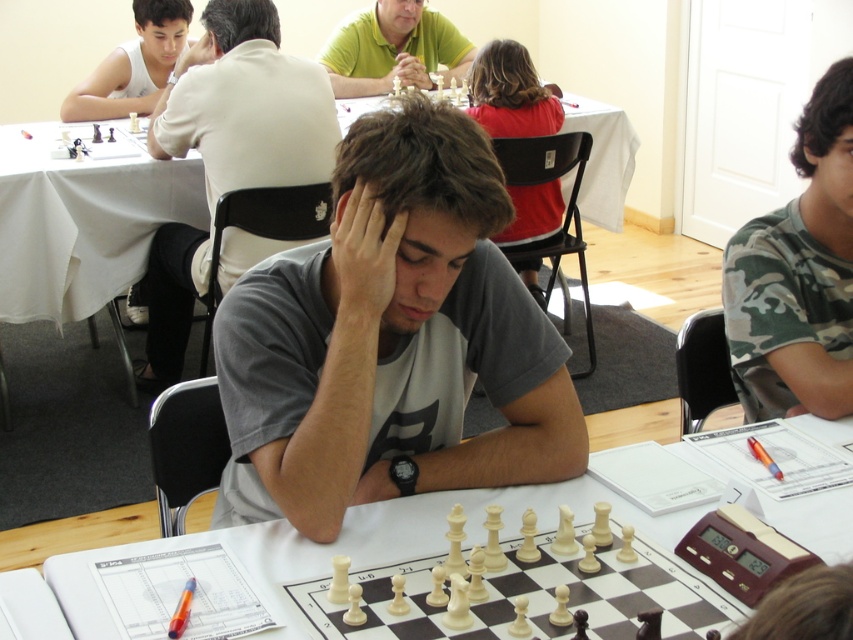
Which of these two, white cloth table at center or ivory wood chess set at center, stands shorter?

ivory wood chess set at center is shorter.

This screenshot has width=853, height=640. Describe the element at coordinates (80, 221) in the screenshot. I see `white cloth table at center` at that location.

Where is `white cloth table at center`? Image resolution: width=853 pixels, height=640 pixels. white cloth table at center is located at coordinates (80, 221).

Locate an element on the screen. Image resolution: width=853 pixels, height=640 pixels. matte green polo shirt at center is located at coordinates pos(393,49).

Is matte green polo shirt at center thinner than blonde hair at upper center?

Incorrect, matte green polo shirt at center's width is not less than blonde hair at upper center's.

Between point (386, 48) and point (515, 77), which one is positioned behind?

The point (386, 48) is more distant.

I want to click on matte green polo shirt at center, so click(393, 49).

Does camo fabric shirt at right come behind dark gray hair at center?

Yes, it is.

Which is behind, point (793, 202) or point (466, 132)?

Positioned behind is point (793, 202).

This screenshot has width=853, height=640. Find the location of `camo fabric shirt at right`. camo fabric shirt at right is located at coordinates (798, 275).